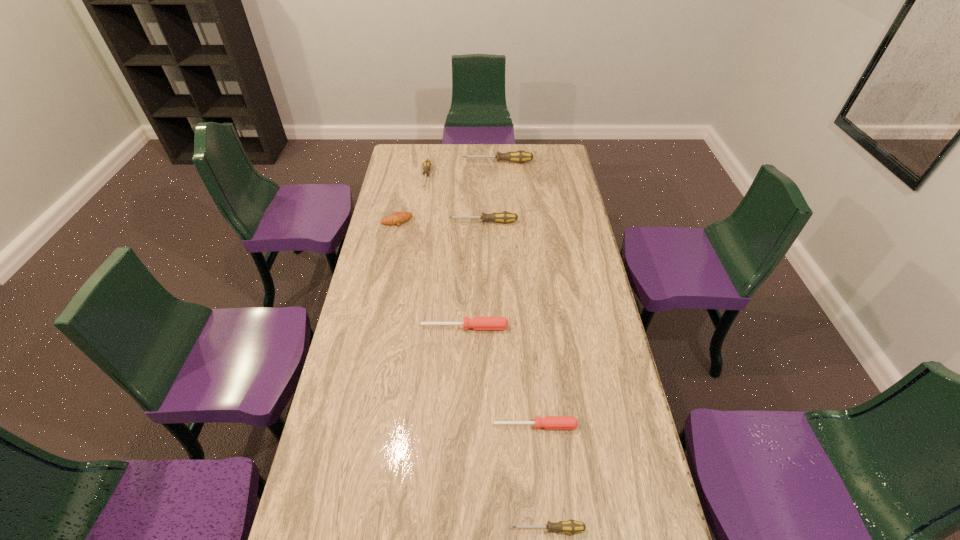
Locate an element on the screen. Image resolution: width=960 pixels, height=540 pixels. the biggest gray screwdriver is located at coordinates (519, 156).

This screenshot has width=960, height=540. What are the coordinates of `the tallest object` in the screenshot? It's located at coord(519,156).

I want to click on the third farthest gray screwdriver, so click(504, 217).

Where is `the second biggest gray screwdriver`? the second biggest gray screwdriver is located at coordinates (504, 217).

Where is `the second object from left to right`? The height and width of the screenshot is (540, 960). the second object from left to right is located at coordinates click(427, 163).

You are a GUI agent. You are given a task and a screenshot of the screen. Output one action in this format:
    pyautogui.click(x=<x>, y=<y>)
    Task: Click on the leftmost screwdriver
    
    Given the screenshot: What is the action you would take?
    pyautogui.click(x=427, y=163)

Where is `crescent roll`? crescent roll is located at coordinates (397, 218).

Identify the location of the farther red screwdriver. (477, 323).

At what (x,y) coordinates should I click in order to perform the action: click on the third nearest screwdriver. Please return your answer as a coordinate pair (x, y). Looking at the image, I should click on (477, 323).

Where is `the fifth farthest screwdriver`? the fifth farthest screwdriver is located at coordinates (548, 422).